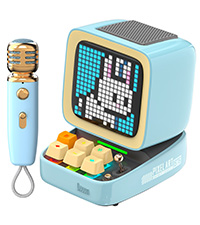
Locate an element on the screen. This screenshot has height=225, width=200. computer screen is located at coordinates (90, 60).